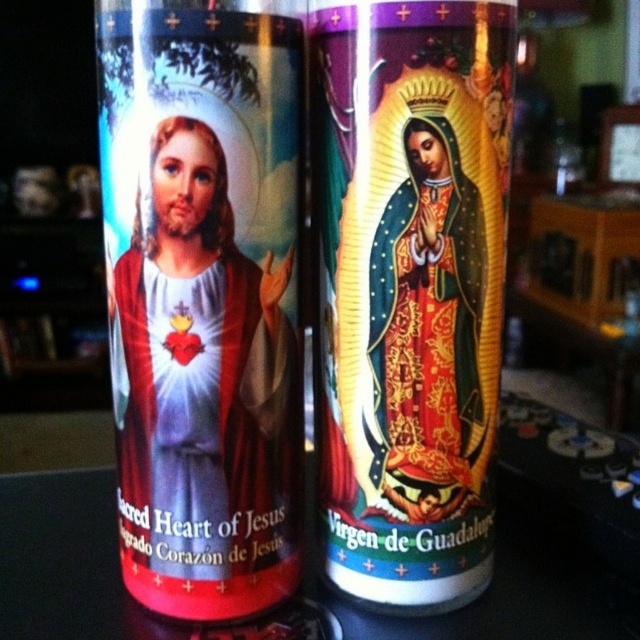
Question: Which point is farther from the camera taking this photo?

Choices:
 (A) (136, 483)
 (B) (440, 17)

Answer: (A)

Question: Does matte red candle at left lie behind matte gold virgin of guadalupe at center?

Choices:
 (A) yes
 (B) no

Answer: (B)

Question: Is matte red candle at left closer to camera compared to matte gold virgin of guadalupe at center?

Choices:
 (A) no
 (B) yes

Answer: (B)

Question: Considering the relative positions of matte red candle at left and matte gold virgin of guadalupe at center in the image provided, where is matte red candle at left located with respect to matte gold virgin of guadalupe at center?

Choices:
 (A) right
 (B) left

Answer: (B)